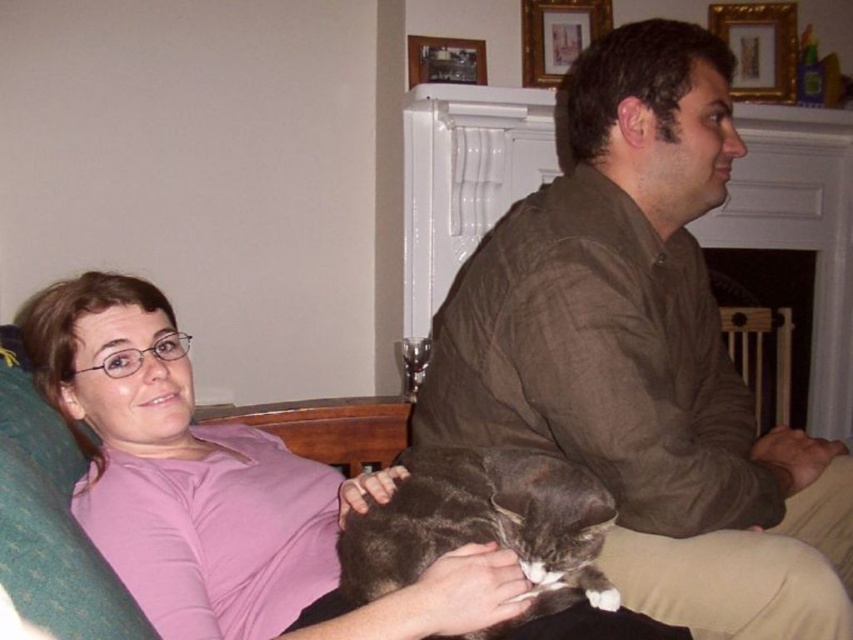
You are standing in the living room and see two points marked in the scene. The first point is at coordinates point (x=488, y=536) and the second is at point (x=776, y=38). Which point is closer to you?

Point (x=488, y=536) is in front of point (x=776, y=38), so it is closer to you.